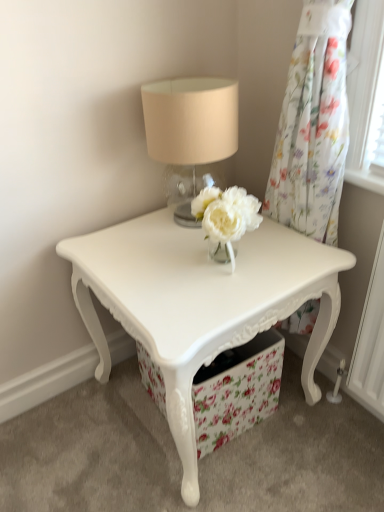
The image size is (384, 512). Identify the location of vacant area located to the right-hand side of floral fabric drawer at center. (314, 421).